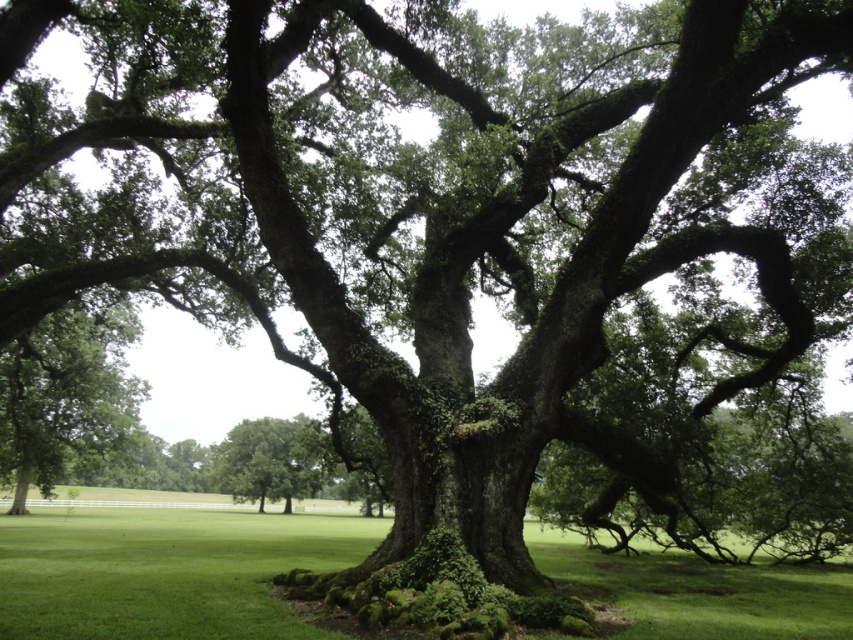
Question: Which point is closer to the camera taking this photo?

Choices:
 (A) (300, 468)
 (B) (376, 536)

Answer: (B)

Question: Which object appears closest to the camera in this image?

Choices:
 (A) green mossy tree at center
 (B) green mossy grass at lower center

Answer: (B)

Question: Which point appears farthest from the camera in this image?

Choices:
 (A) (48, 577)
 (B) (306, 444)

Answer: (B)

Question: Does green mossy grass at lower center appear over green mossy tree at center?

Choices:
 (A) yes
 (B) no

Answer: (B)

Question: Can you confirm if green mossy grass at lower center is positioned below green mossy tree at center?

Choices:
 (A) no
 (B) yes

Answer: (B)

Question: Can you confirm if green mossy grass at lower center is wider than green mossy tree at center?

Choices:
 (A) no
 (B) yes

Answer: (B)